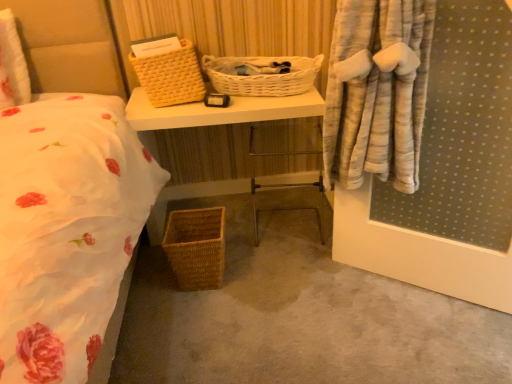
Locate an element on the screen. Image resolution: width=512 pixels, height=384 pixels. vacant area located to the right-hand side of woven brown picnic basket at lower center, the 1th picnic basket from the bottom is located at coordinates (250, 276).